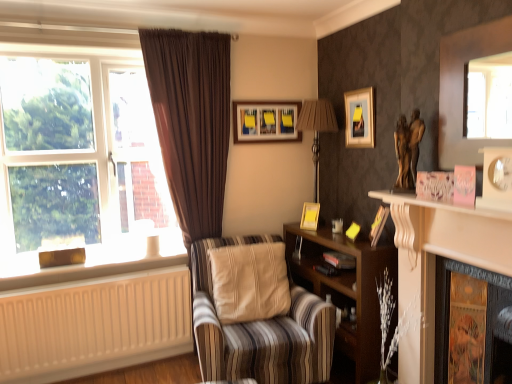
Find the location of a particular element. Image resolution: width=512 pixels, height=384 pixels. gold textured fireplace at lower right, which ranks as the second fireplace in left-to-right order is located at coordinates (449, 311).

What is the approximate width of wooden picture frame at right, which is the fourth picture frame from top to bottom?

wooden picture frame at right, which is the fourth picture frame from top to bottom, is 5.81 inches in width.

Identify the location of gold textured fireplace at lower right, which ranks as the second fireplace in left-to-right order. (449, 311).

Where is `the 2nd picture frame above the white glossy fireplace at right, positioned as the 2th fireplace in right-to-left order (from the image's perspective)`? The image size is (512, 384). the 2nd picture frame above the white glossy fireplace at right, positioned as the 2th fireplace in right-to-left order (from the image's perspective) is located at coordinates (310, 216).

Which is further, (x=506, y=234) or (x=300, y=223)?

The point (x=300, y=223) is farther.

In the image, is white glossy fireplace at right, positioned as the 2th fireplace in right-to-left order, positioned in front of or behind wooden picture frame at center, the 2th picture frame from the bottom?

white glossy fireplace at right, positioned as the 2th fireplace in right-to-left order, is positioned closer to the viewer than wooden picture frame at center, the 2th picture frame from the bottom.

Who is bigger, white glossy fireplace at right, positioned as the 2th fireplace in right-to-left order, or wooden picture frame at center, the 2th picture frame positioned from the left?

With larger size is white glossy fireplace at right, positioned as the 2th fireplace in right-to-left order.

Which picture frame is the 1st one when counting from the back of the white matte radiator at lower left? Please provide its 2D coordinates.

[(360, 118)]

Does point (368, 115) appear closer or farther from the camera than point (66, 303)?

Clearly, point (368, 115) is more distant from the camera than point (66, 303).

Is matte yellow picture frame at upper right, placed as the 3th picture frame when sorted from bottom to top, facing towards white matte radiator at lower left?

No.

Considering the sizes of matte yellow picture frame at upper right, the second picture frame in the top-to-bottom sequence, and white matte radiator at lower left in the image, is matte yellow picture frame at upper right, the second picture frame in the top-to-bottom sequence, taller or shorter than white matte radiator at lower left?

Clearly, matte yellow picture frame at upper right, the second picture frame in the top-to-bottom sequence, is shorter compared to white matte radiator at lower left.

Which of these two, white glossy fireplace at right, acting as the first fireplace starting from the left, or metallic silver table lamp at upper center, stands shorter?

metallic silver table lamp at upper center.

Visually, is white glossy fireplace at right, positioned as the 2th fireplace in right-to-left order, positioned to the left or to the right of metallic silver table lamp at upper center?

Based on their positions, white glossy fireplace at right, positioned as the 2th fireplace in right-to-left order, is located to the right of metallic silver table lamp at upper center.

Is white glossy fireplace at right, positioned as the 2th fireplace in right-to-left order, touching metallic silver table lamp at upper center?

No, white glossy fireplace at right, positioned as the 2th fireplace in right-to-left order, is not beside metallic silver table lamp at upper center.

Is wooden picture frame at right, the first picture frame positioned from the front, shorter than white matte radiator at lower left?

Indeed, wooden picture frame at right, the first picture frame positioned from the front, has a lesser height compared to white matte radiator at lower left.

Considering the positions of points (381, 217) and (20, 343), is point (381, 217) farther from camera compared to point (20, 343)?

Yes, it is.

Where is `the 1st picture frame above when counting from the white matte radiator at lower left (from the image's perspective)`? the 1st picture frame above when counting from the white matte radiator at lower left (from the image's perspective) is located at coordinates (378, 224).

From a real-world perspective, between wooden picture frame at right, the fourth picture frame in the back-to-front sequence, and white matte radiator at lower left, who is vertically higher?

From a 3D spatial view, wooden picture frame at right, the fourth picture frame in the back-to-front sequence, is above.

In the image, there is a matte yellow picture frame at upper right, the second picture frame when ordered from front to back. Identify the location of book below it (from a real-world perspective). (335, 263).

Is black matte book at center touching matte yellow picture frame at upper right, placed as the 3th picture frame when sorted from bottom to top?

There is a gap between black matte book at center and matte yellow picture frame at upper right, placed as the 3th picture frame when sorted from bottom to top.

Is black matte book at center wider or thinner than matte yellow picture frame at upper right, placed as the 3th picture frame when sorted from back to front?

black matte book at center is wider than matte yellow picture frame at upper right, placed as the 3th picture frame when sorted from back to front.

From the picture: Which object is closer to the camera taking this photo, black matte book at center or matte yellow picture frame at upper right, placed as the 2th picture frame when sorted from right to left?

matte yellow picture frame at upper right, placed as the 2th picture frame when sorted from right to left, is more forward.

At what (x,y) coordinates should I click in order to perform the action: click on shelf that appears below the wooden picture frame at right, which is the 1th picture frame from right to left (from a real-world perspective). Please return your answer as a coordinate pair (x, y). The height and width of the screenshot is (384, 512). Looking at the image, I should click on (346, 290).

Is wooden shelf at center looking in the opposite direction of wooden picture frame at right, the 4th picture frame in the left-to-right sequence?

wooden shelf at center is not turned away from wooden picture frame at right, the 4th picture frame in the left-to-right sequence.

Considering their positions, is wooden shelf at center located in front of or behind wooden picture frame at right, the 4th picture frame in the left-to-right sequence?

Clearly, wooden shelf at center is in front of wooden picture frame at right, the 4th picture frame in the left-to-right sequence.

Considering the sizes of objects wooden shelf at center and wooden picture frame at right, the first picture frame positioned from the front, in the image provided, who is taller, wooden shelf at center or wooden picture frame at right, the first picture frame positioned from the front,?

With more height is wooden shelf at center.

In the scene shown: Is wooden picture frame at right, which is the 1th picture frame from right to left, at the left side of matte wooden picture frame at upper center, which appears as the first picture frame when viewed from the back?

Incorrect, wooden picture frame at right, which is the 1th picture frame from right to left, is not on the left side of matte wooden picture frame at upper center, which appears as the first picture frame when viewed from the back.

Is wooden picture frame at right, the fourth picture frame in the back-to-front sequence, oriented away from matte wooden picture frame at upper center, the 4th picture frame from the front?

No.

From the picture: Is wooden picture frame at right, which is the fourth picture frame from top to bottom, inside the boundaries of matte wooden picture frame at upper center, placed as the fourth picture frame when sorted from right to left, or outside?

wooden picture frame at right, which is the fourth picture frame from top to bottom, is located beyond the bounds of matte wooden picture frame at upper center, placed as the fourth picture frame when sorted from right to left.

This screenshot has width=512, height=384. Find the location of `the 1st fireplace located beneath the wooden picture frame at center, placed as the third picture frame when sorted from front to back (from a real-world perspective)`. the 1st fireplace located beneath the wooden picture frame at center, placed as the third picture frame when sorted from front to back (from a real-world perspective) is located at coordinates (435, 265).

You are a GUI agent. You are given a task and a screenshot of the screen. Output one action in this format:
    pyautogui.click(x=<x>, y=<y>)
    Task: Click on the radiator that is on the left side of matte yellow picture frame at upper right, placed as the 3th picture frame when sorted from bottom to top
    The height and width of the screenshot is (384, 512).
    Given the screenshot: What is the action you would take?
    pyautogui.click(x=94, y=325)

From the picture: Which object lies nearer to the anchor point wooden picture frame at right, which is the fourth picture frame from top to bottom, matte yellow picture frame at upper right, the second picture frame when ordered from front to back, or gold textured fireplace at lower right, which ranks as the second fireplace in left-to-right order?

Based on the image, matte yellow picture frame at upper right, the second picture frame when ordered from front to back, appears to be nearer to wooden picture frame at right, which is the fourth picture frame from top to bottom.

Considering their positions, is beige painted wood at lower left positioned closer to white glossy fireplace at right, acting as the first fireplace starting from the left, than brown fabric curtain at left?

Among the two, brown fabric curtain at left is located nearer to white glossy fireplace at right, acting as the first fireplace starting from the left.

Based on their spatial positions, is white glossy fireplace at right, positioned as the 2th fireplace in right-to-left order, or wooden picture frame at center, the 2th picture frame positioned from the left, closer to matte wooden picture frame at upper center, placed as the fourth picture frame when sorted from right to left?

wooden picture frame at center, the 2th picture frame positioned from the left, lies closer to matte wooden picture frame at upper center, placed as the fourth picture frame when sorted from right to left, than the other object.

Based on the photo, considering their positions, is beige painted wood at lower left positioned closer to black matte book at center than clear glass window at left?

beige painted wood at lower left lies closer to black matte book at center than the other object.

Considering their positions, is matte wooden picture frame at upper center, placed as the fourth picture frame when sorted from right to left, positioned further to white matte radiator at lower left than striped fabric armchair at center?

The object further to white matte radiator at lower left is matte wooden picture frame at upper center, placed as the fourth picture frame when sorted from right to left.

Looking at the image, which one is located closer to matte wooden picture frame at upper center, placed as the fourth picture frame when sorted from right to left, wooden shelf at center or white glossy fireplace at right, positioned as the 2th fireplace in right-to-left order?

The object closer to matte wooden picture frame at upper center, placed as the fourth picture frame when sorted from right to left, is wooden shelf at center.

Based on their spatial positions, is beige painted wood at lower left or gold textured fireplace at lower right, the first fireplace in the right-to-left sequence, further from matte yellow picture frame at upper right, placed as the 3th picture frame when sorted from bottom to top?

beige painted wood at lower left is further to matte yellow picture frame at upper right, placed as the 3th picture frame when sorted from bottom to top.

Based on their spatial positions, is clear glass window at left or white glossy fireplace at right, acting as the first fireplace starting from the left, closer to wooden picture frame at right, the fourth picture frame in the back-to-front sequence?

The object closer to wooden picture frame at right, the fourth picture frame in the back-to-front sequence, is white glossy fireplace at right, acting as the first fireplace starting from the left.

At what (x,y) coordinates should I click in order to perform the action: click on table lamp between gold textured fireplace at lower right, which ranks as the second fireplace in left-to-right order, and wooden picture frame at center, placed as the third picture frame when sorted from front to back, from front to back. Please return your answer as a coordinate pair (x, y). The image size is (512, 384). Looking at the image, I should click on (317, 129).

The height and width of the screenshot is (384, 512). I want to click on curtain between white matte radiator at lower left and gold textured fireplace at lower right, which ranks as the second fireplace in left-to-right order, from left to right, so click(x=191, y=122).

This screenshot has width=512, height=384. I want to click on radiator between clear glass window at left and wooden picture frame at center, placed as the third picture frame when sorted from front to back, in the horizontal direction, so click(x=94, y=325).

In order to click on book between white glossy fireplace at right, positioned as the 2th fireplace in right-to-left order, and wooden picture frame at center, the 2th picture frame positioned from the left, from front to back in this screenshot , I will do `click(335, 263)`.